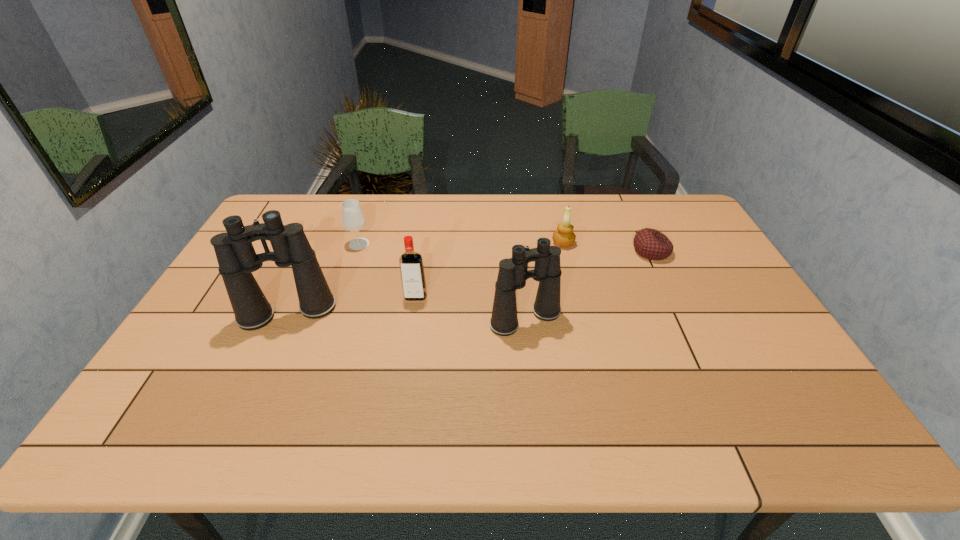
Where is `free location at the right edge of the desktop`? The width and height of the screenshot is (960, 540). free location at the right edge of the desktop is located at coordinates (739, 342).

This screenshot has width=960, height=540. What are the coordinates of `vacant space at the near right corner` in the screenshot? It's located at (736, 370).

Find the location of a particular element. This screenshot has width=960, height=540. free space between the glass and the fourth shortest object is located at coordinates (387, 270).

Where is `empty space between the glass and the third tallest object`? This screenshot has height=540, width=960. empty space between the glass and the third tallest object is located at coordinates (387, 270).

Where is `free space between the fourth object from right to left and the taller binoculars`? The image size is (960, 540). free space between the fourth object from right to left and the taller binoculars is located at coordinates (351, 305).

Find the location of a particular element. The width and height of the screenshot is (960, 540). free space that is in between the fourth object from left to right and the vodka is located at coordinates (470, 308).

Where is `free space that is in between the shorter binoculars and the taller binoculars`? This screenshot has width=960, height=540. free space that is in between the shorter binoculars and the taller binoculars is located at coordinates (407, 316).

This screenshot has height=540, width=960. Find the location of `free area in between the fifth shortest object and the beanbag`. free area in between the fifth shortest object and the beanbag is located at coordinates (588, 285).

You are a GUI agent. You are given a task and a screenshot of the screen. Output one action in this format:
    pyautogui.click(x=<x>, y=<y>)
    Task: Click on the free point between the glass and the fourth shortest object
    This screenshot has height=540, width=960.
    Given the screenshot: What is the action you would take?
    pyautogui.click(x=387, y=270)

This screenshot has height=540, width=960. In order to click on vacant area that lies between the candle_holder and the third object from left to right in this screenshot , I will do `click(490, 269)`.